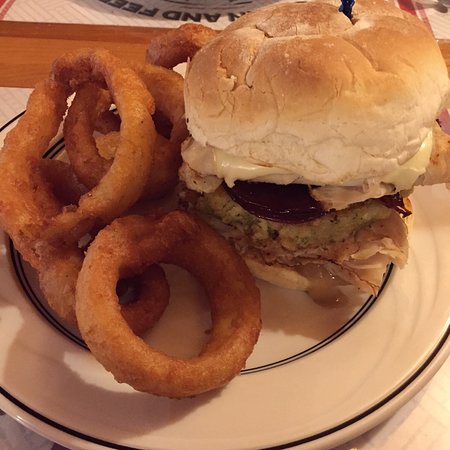
Where is `placemats`? This screenshot has height=450, width=450. placemats is located at coordinates (8, 110), (105, 13).